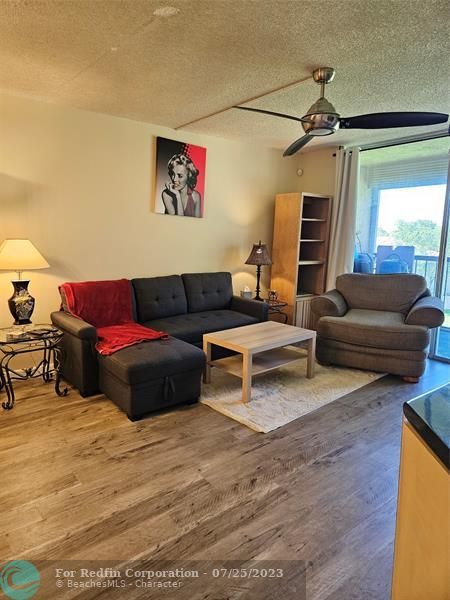
This screenshot has width=450, height=600. In order to click on window in this screenshot , I will do `click(417, 215)`.